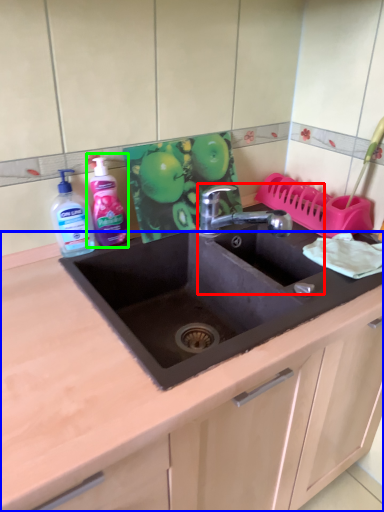
Question: Based on their relative distances, which object is farther from sink (highlighted by a red box)? Choose from countertop (highlighted by a blue box) and cleaning product (highlighted by a green box).

Choices:
 (A) countertop
 (B) cleaning product

Answer: (A)